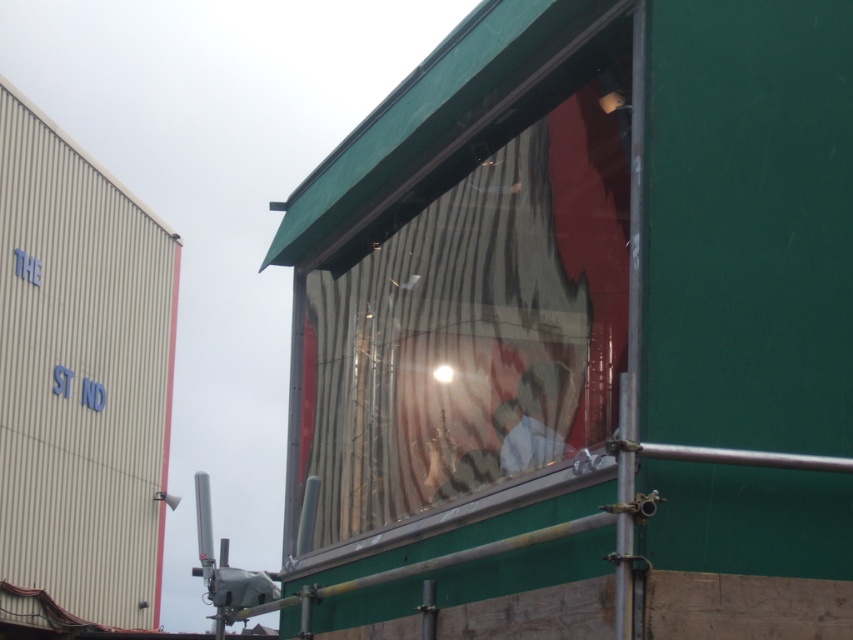
Question: Is transparent glass window at center positioned at the back of white fabric at center?

Choices:
 (A) yes
 (B) no

Answer: (B)

Question: Does transparent glass window at center lie behind white fabric at center?

Choices:
 (A) no
 (B) yes

Answer: (A)

Question: Which object is closer to the camera taking this photo?

Choices:
 (A) transparent glass window at center
 (B) white fabric at center

Answer: (A)

Question: Is transparent glass window at center closer to the viewer compared to white fabric at center?

Choices:
 (A) yes
 (B) no

Answer: (A)

Question: Which of the following is the farthest from the observer?

Choices:
 (A) (326, 369)
 (B) (512, 465)

Answer: (A)